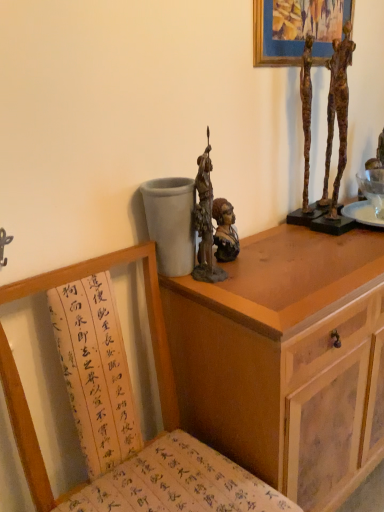
Question: Looking at the image, does rusty bronze statue at center seem bigger or smaller compared to bronze bust at center, the first person positioned from the left?

Choices:
 (A) big
 (B) small

Answer: (A)

Question: Does point (203, 151) appear closer or farther from the camera than point (215, 201)?

Choices:
 (A) closer
 (B) farther

Answer: (A)

Question: Which of these objects is positioned closest to the rusty bronze statue at center?

Choices:
 (A) wooden chair with calligraphy cushion at lower left
 (B) bronze bust at center, the first person positioned from the left
 (C) wooden cabinet at upper right
 (D) rusty metal sculpture at upper right, which is counted as the 2th person, starting from the left

Answer: (B)

Question: Estimate the real-world distances between objects in this image. Which object is farther from the rusty bronze statue at center?

Choices:
 (A) bronze bust at center, the first person positioned from the left
 (B) wooden chair with calligraphy cushion at lower left
 (C) rusty metal sculpture at upper right, which ranks as the 1th person in right-to-left order
 (D) wooden cabinet at upper right

Answer: (C)